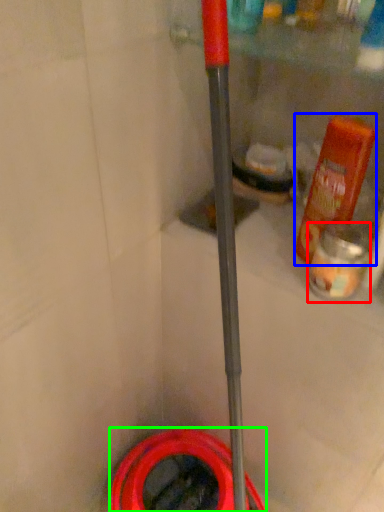
Question: Which object is the closest to the cleaning product (highlighted by a red box)? Choose among these: bottle (highlighted by a blue box) or garden hose (highlighted by a green box).

Choices:
 (A) bottle
 (B) garden hose

Answer: (A)